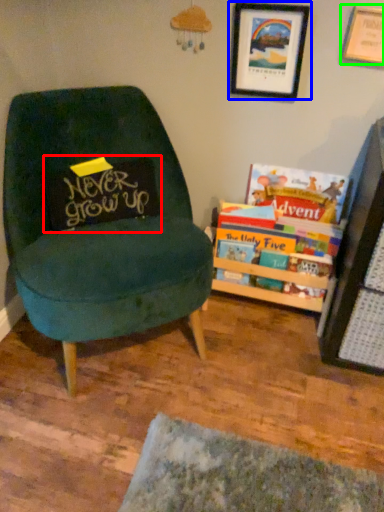
Question: Based on their relative distances, which object is nearer to pillow (highlighted by a red box)? Choose from picture frame (highlighted by a blue box) and picture frame (highlighted by a green box).

Choices:
 (A) picture frame
 (B) picture frame

Answer: (A)